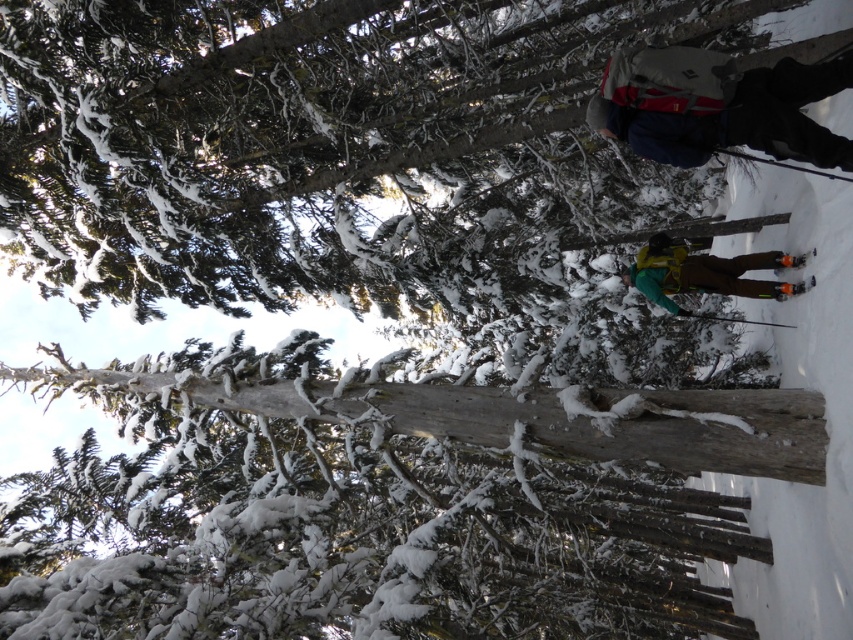
You are planning to carry both the gray fabric backpack at upper right and the orange reflective ski at lower right. Which object will take up more space in your luggage?

The gray fabric backpack at upper right is larger in size than the orange reflective ski at lower right, so it will take up more space in your luggage.

You are a hiker in the snowy forest and see the gray fabric backpack at upper right and the orange reflective ski at lower right. Which object is higher up in the scene?

The gray fabric backpack at upper right is located above the orange reflective ski at lower right, so it is higher up in the scene.